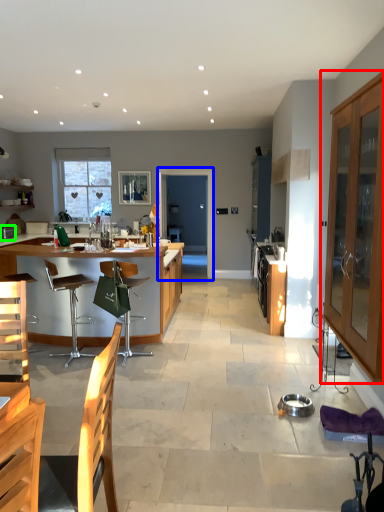
Question: Which is farther away from cabinetry (highlighted by a red box)? glass door (highlighted by a blue box) or appliance (highlighted by a green box)?

Choices:
 (A) glass door
 (B) appliance

Answer: (A)